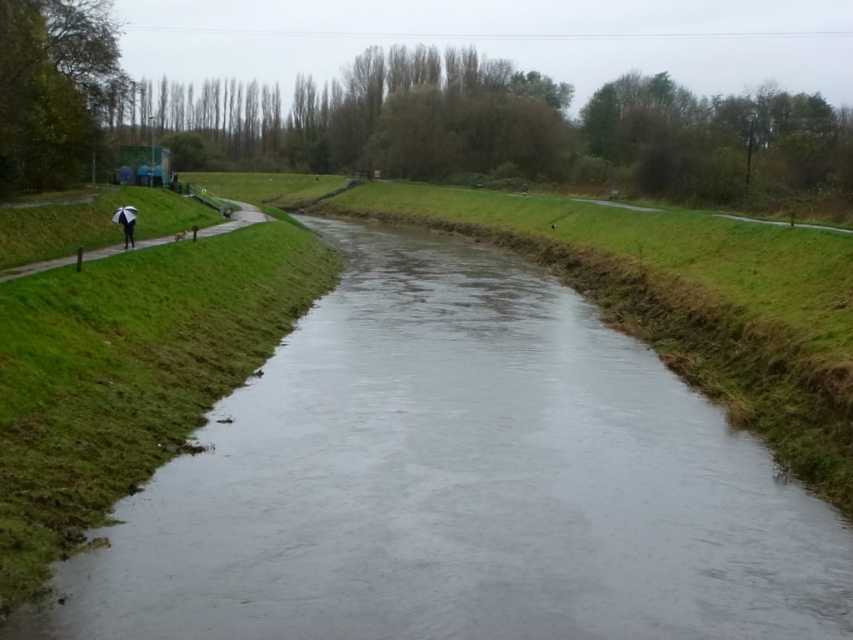
You are standing on the path next to the waterway and want to know if the clear water at center is taller than the white umbrella at left. Can you determine this based on the scene?

The clear water at center is not as tall as the white umbrella at left, so the white umbrella at left is taller.

You are standing on the path next to the waterway and want to take a photo of the clear water at center without the white umbrella at left appearing in the frame. Is this possible given their positions?

The clear water at center is positioned under the white umbrella at left, so the umbrella would likely block the view of the water when taking the photo from the path. To capture the water without the umbrella, you might need to move to a different angle or position where the umbrella is not obstructing the view.